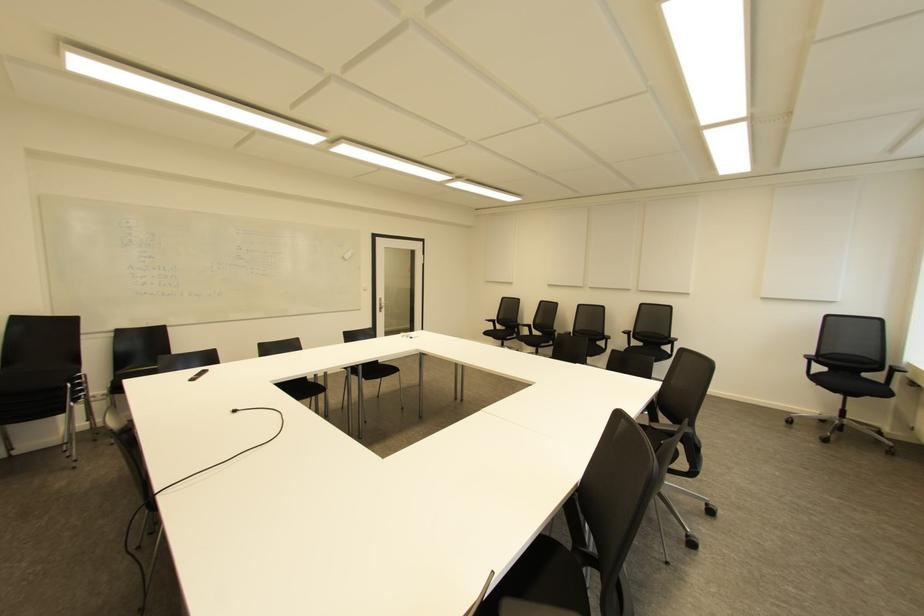
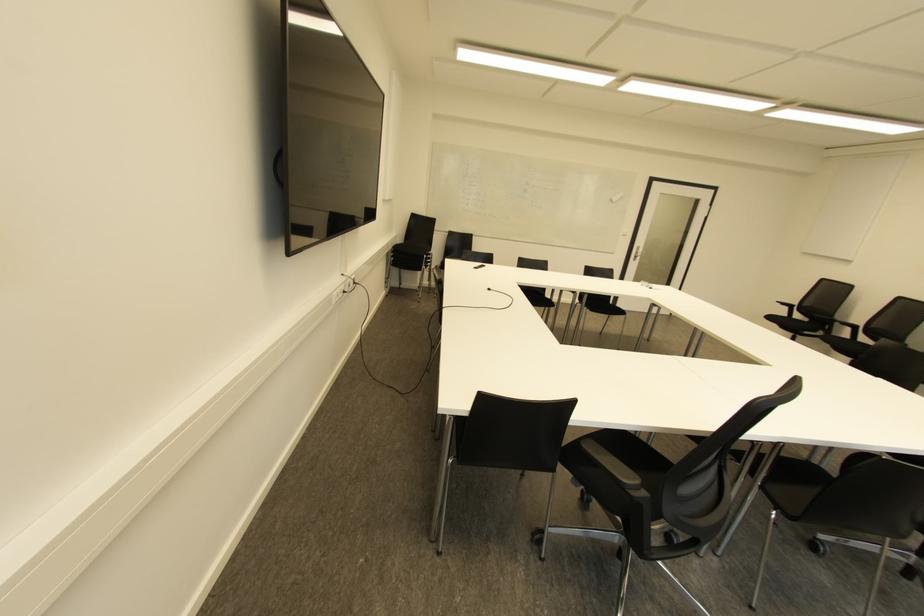
Where in the second image is the point corresponding to pixel 191 379 from the first image?

(475, 268)